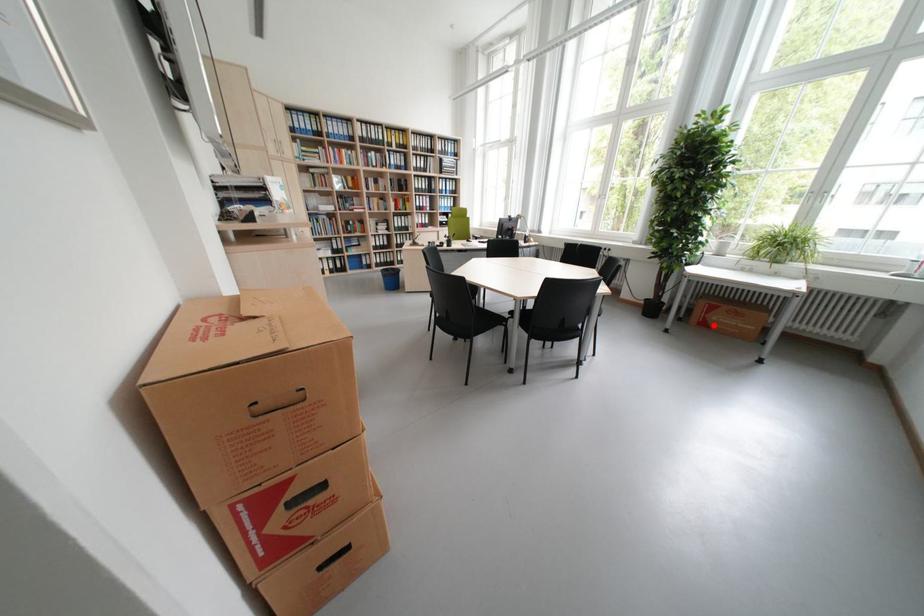
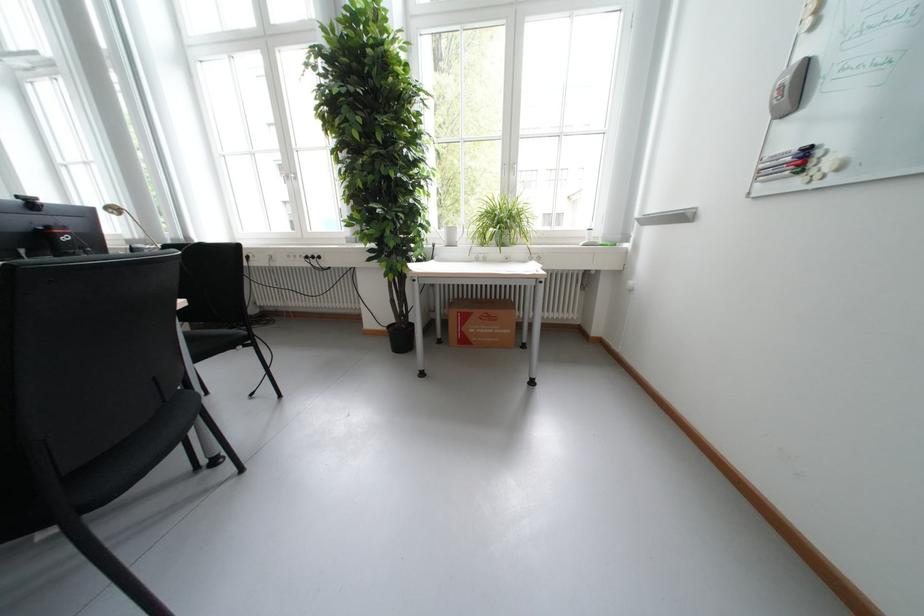
Where in the second image is the point corresponding to the highlighted location from the first image?

(475, 342)